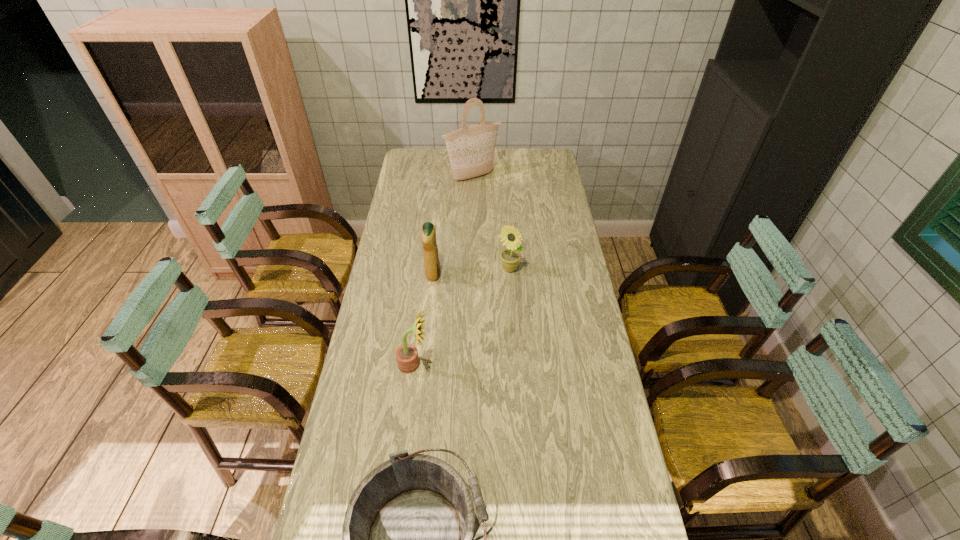
The width and height of the screenshot is (960, 540). I want to click on shopping bag, so click(x=471, y=149).

This screenshot has height=540, width=960. I want to click on the farthest object, so click(x=471, y=149).

In order to click on detergent in this screenshot , I will do `click(428, 235)`.

The width and height of the screenshot is (960, 540). Find the location of `the fourth farthest object`. the fourth farthest object is located at coordinates (407, 358).

At what (x,y) coordinates should I click in order to perform the action: click on the nearer sunflower. Please return your answer as a coordinate pair (x, y). The image size is (960, 540). Looking at the image, I should click on (407, 358).

In order to click on the farther sunflower in this screenshot , I will do `click(510, 258)`.

The width and height of the screenshot is (960, 540). Find the location of `vacant region located 0.220m on the right of the tallest object`. vacant region located 0.220m on the right of the tallest object is located at coordinates (543, 177).

Image resolution: width=960 pixels, height=540 pixels. What are the coordinates of `vacant space located on the label of the detergent` in the screenshot? It's located at (468, 274).

Locate an element on the screen. free space located on the face of the fourth farthest object is located at coordinates (460, 364).

I want to click on free space located 0.180m on the face of the right sunflower, so click(x=513, y=312).